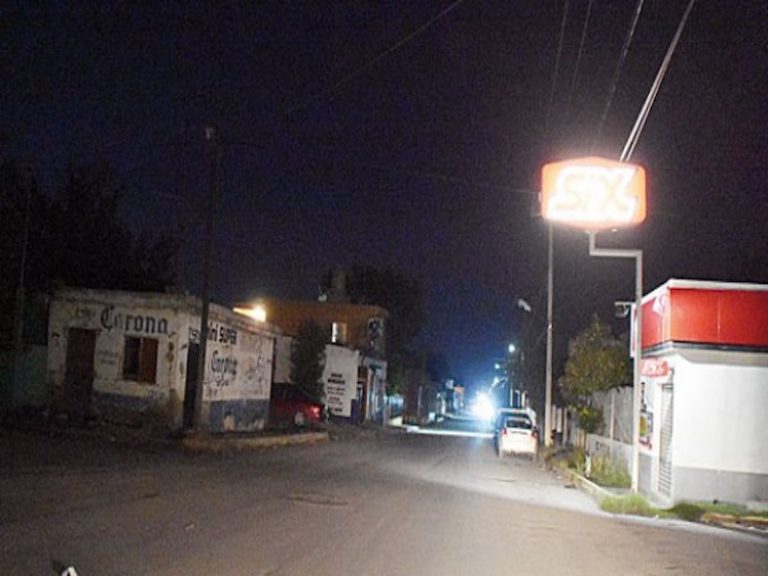
This screenshot has height=576, width=768. What are the coordinates of `neon orange sign` in the screenshot? It's located at (580, 196).